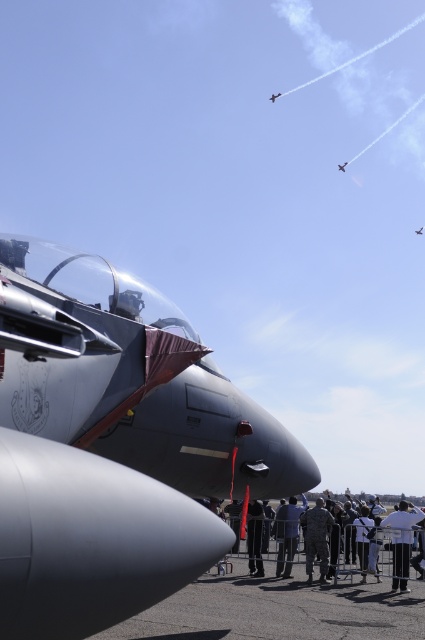
You are a photographer at the airshow trying to capture a photo of the metallic silver airplane at upper center without any obstructions. You notice the white fabric shirt at lower right in your frame. Based on their sizes in the image, which object would you need to adjust your camera angle to avoid?

The white fabric shirt at lower right occupies less space than the metallic silver airplane at upper center, so the photographer should adjust their camera angle to avoid the larger metallic silver airplane at upper center as it takes up more of the frame and could obstruct the view.

You are a photographer trying to capture a clear shot of the metallic silver jet at upper center without any obstructions. You notice the black fabric pants at lower center in your frame. Based on their position, can you adjust your camera angle to the left or right to avoid the pants?

The black fabric pants at lower center are to the left of the metallic silver jet at upper center. To avoid the pants, you should adjust your camera angle to the right.